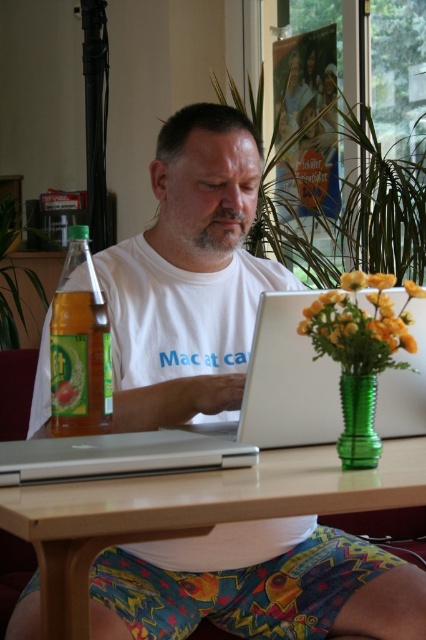
Question: Is wooden table at center to the left of yellow matte vase at center from the viewer's perspective?

Choices:
 (A) no
 (B) yes

Answer: (B)

Question: Among these objects, which one is farthest from the camera?

Choices:
 (A) yellow matte vase at right
 (B) wooden table at center
 (C) white plastic laptop at center
 (D) yellow matte vase at upper right

Answer: (C)

Question: Which point is closer to the camera?

Choices:
 (A) yellow matte vase at right
 (B) translucent yellow bottle at left
 (C) wooden table at center

Answer: (C)

Question: Can you confirm if yellow matte vase at right is positioned below green glass vase at lower right?

Choices:
 (A) no
 (B) yes

Answer: (A)

Question: Where is white plastic laptop at center located in relation to yellow matte vase at upper right in the image?

Choices:
 (A) left
 (B) right

Answer: (A)

Question: Which of the following is the closest to the observer?

Choices:
 (A) wooden table at center
 (B) translucent yellow bottle at left

Answer: (A)